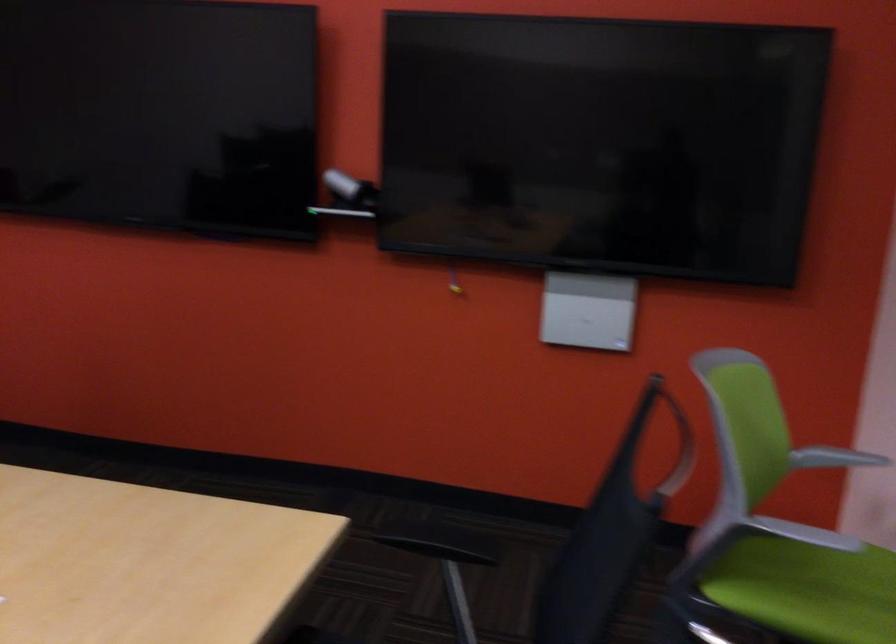
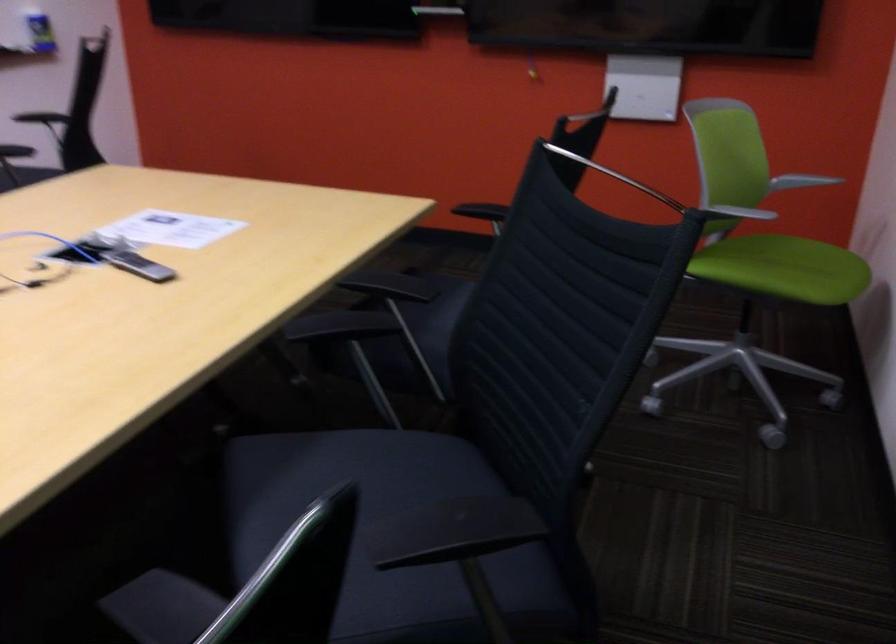
Question: How did the camera likely rotate?

Choices:
 (A) Left
 (B) Right
 (C) Up
 (D) Down

Answer: (D)